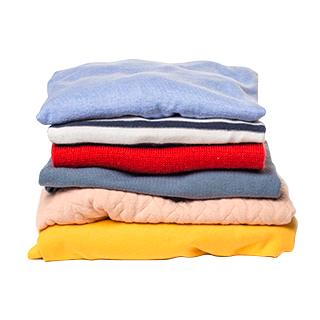
Where is `folded laundry`? The image size is (320, 320). folded laundry is located at coordinates (146, 242), (152, 215), (172, 190), (165, 157), (155, 128), (166, 103).